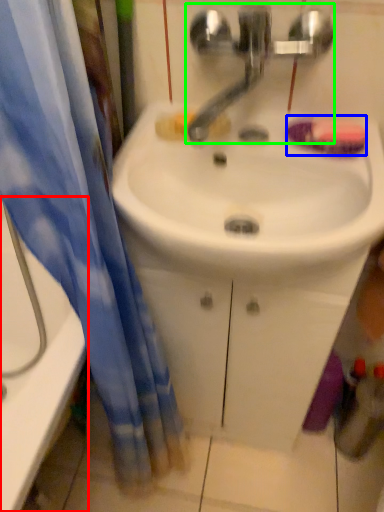
Question: Which is farther away from bathtub (highlighted by a red box)? soap (highlighted by a blue box) or tap (highlighted by a green box)?

Choices:
 (A) soap
 (B) tap

Answer: (A)